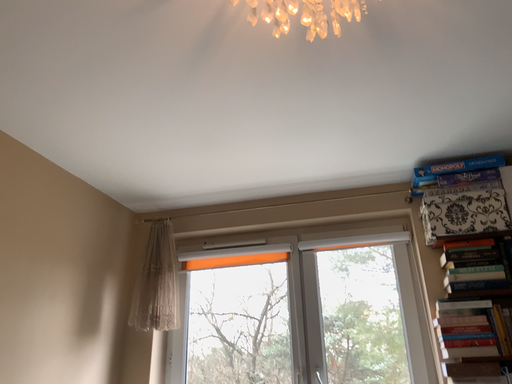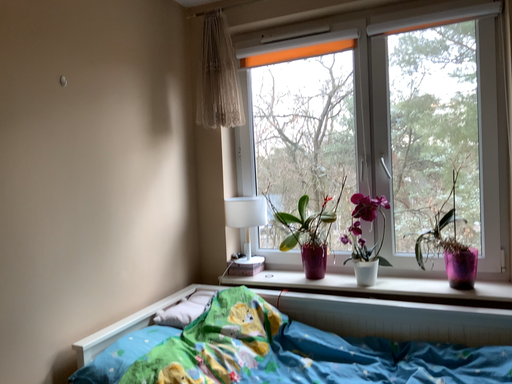
Question: Which way did the camera rotate in the video?

Choices:
 (A) rotated downward
 (B) rotated upward

Answer: (A)